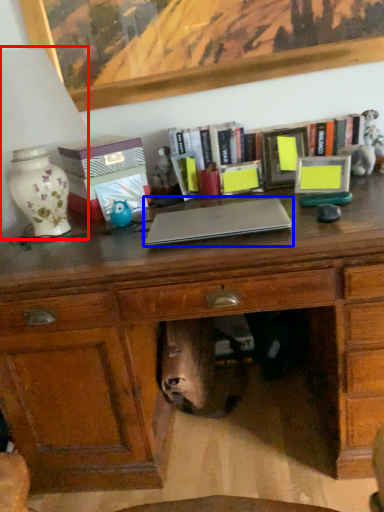
Question: Which of the following is the closest to the observer, table lamp (highlighted by a red box) or laptop (highlighted by a blue box)?

Choices:
 (A) table lamp
 (B) laptop

Answer: (A)